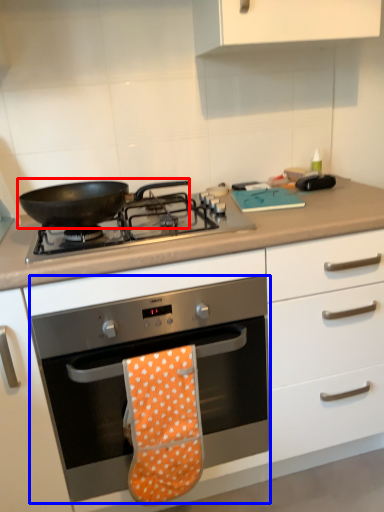
Question: Which point is further to the camera, kitchen appliance (highlighted by a red box) or oven (highlighted by a blue box)?

Choices:
 (A) kitchen appliance
 (B) oven

Answer: (A)